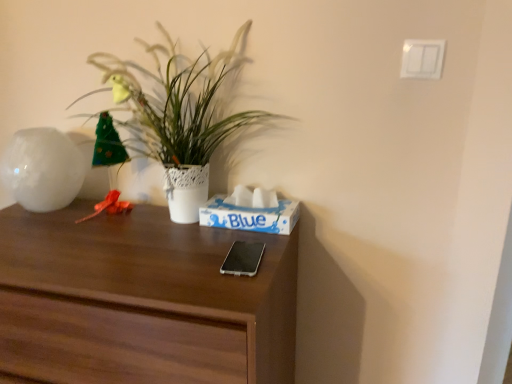
Question: Is silver metallic phone at center bigger than white glossy vase at left?

Choices:
 (A) yes
 (B) no

Answer: (B)

Question: Does silver metallic phone at center have a lesser height compared to white glossy vase at left?

Choices:
 (A) no
 (B) yes

Answer: (B)

Question: Is silver metallic phone at center facing away from white glossy vase at left?

Choices:
 (A) yes
 (B) no

Answer: (B)

Question: Does silver metallic phone at center turn towards white glossy vase at left?

Choices:
 (A) yes
 (B) no

Answer: (B)

Question: From a real-world perspective, is silver metallic phone at center below white glossy vase at left?

Choices:
 (A) no
 (B) yes

Answer: (B)

Question: Is the depth of silver metallic phone at center greater than that of white glossy vase at left?

Choices:
 (A) no
 (B) yes

Answer: (A)

Question: Could dark wood desk at center be considered to be inside silver metallic phone at center?

Choices:
 (A) yes
 (B) no

Answer: (B)

Question: From a real-world perspective, is silver metallic phone at center on top of dark wood desk at center?

Choices:
 (A) yes
 (B) no

Answer: (A)

Question: From the image's perspective, is silver metallic phone at center on top of dark wood desk at center?

Choices:
 (A) no
 (B) yes

Answer: (B)

Question: Is silver metallic phone at center outside of dark wood desk at center?

Choices:
 (A) yes
 (B) no

Answer: (B)

Question: Can you confirm if silver metallic phone at center is positioned to the left of dark wood desk at center?

Choices:
 (A) no
 (B) yes

Answer: (A)

Question: Considering the relative positions of silver metallic phone at center and dark wood desk at center in the image provided, is silver metallic phone at center to the right of dark wood desk at center from the viewer's perspective?

Choices:
 (A) no
 (B) yes

Answer: (B)

Question: Is blue paper tissue box at center not inside white glossy vase at left?

Choices:
 (A) yes
 (B) no

Answer: (A)